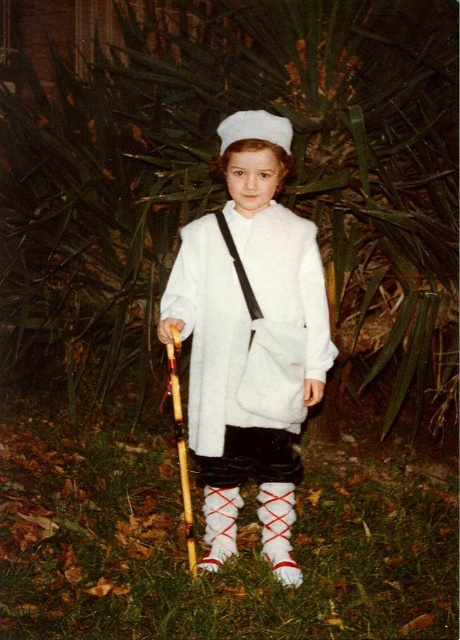
You are a parent trying to ensure your child stays warm during an outdoor event. The child is wearing a white fuzzy coat at center and standing on green grass at lower center. Given that the distance between the two is 32.45 inches, is the coat close enough to the grass to potentially get dirty?

The green grass at lower center is 32.45 inches from the white fuzzy coat at center. Since the distance is more than a foot, the coat is not close enough to the grass to potentially get dirty.

The child is wearing a white fuzzy coat at center and a white felt hat at center. Which item is positioned lower on the child?

The white fuzzy coat at center is located below the white felt hat at center, so the white fuzzy coat at center is positioned lower on the child.

You are a parent trying to take a photo of your child holding a wooden staff. The child is standing in front of a large leafy plant. You want to ensure the staff is visible in the photo. Based on the scene, how far apart are the green grass at lower center and the white felt hat at center?

The green grass at lower center is 2.04 meters away from the white felt hat at center.